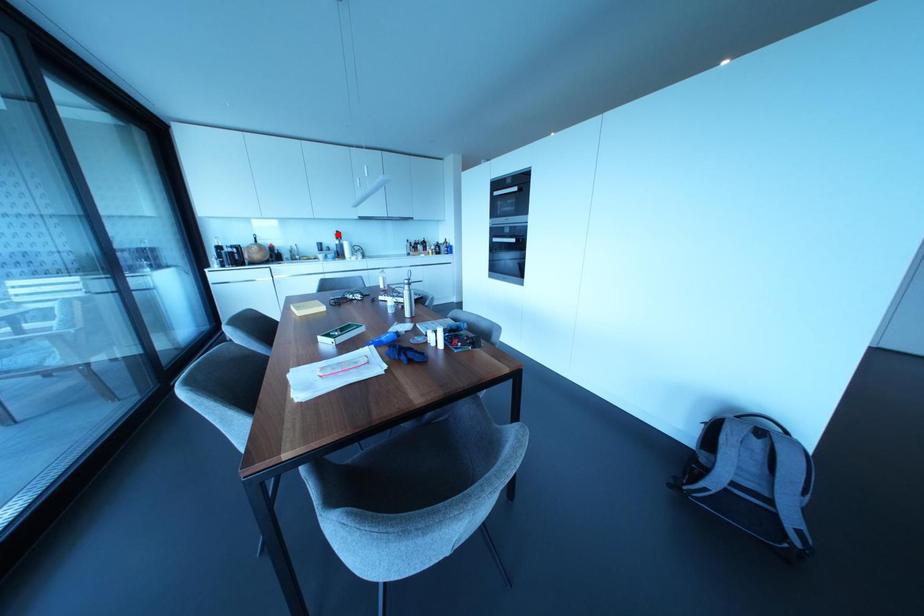
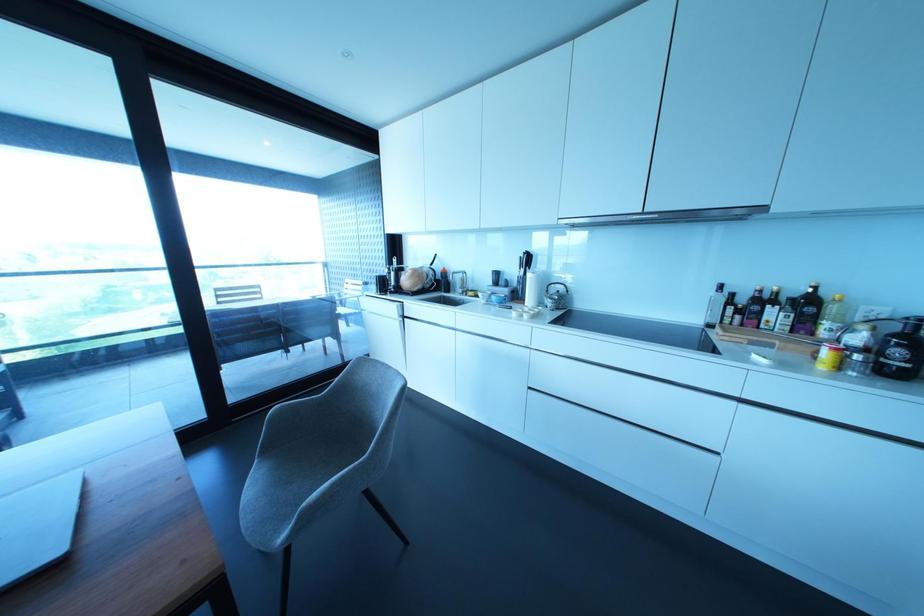
Question: I am providing you with two images of the same scene from different viewpoints. Given a red point in image1, look at the same physical point in image2. Is it:

Choices:
 (A) Closer to the viewpoint
 (B) Farther from the viewpoint

Answer: (B)